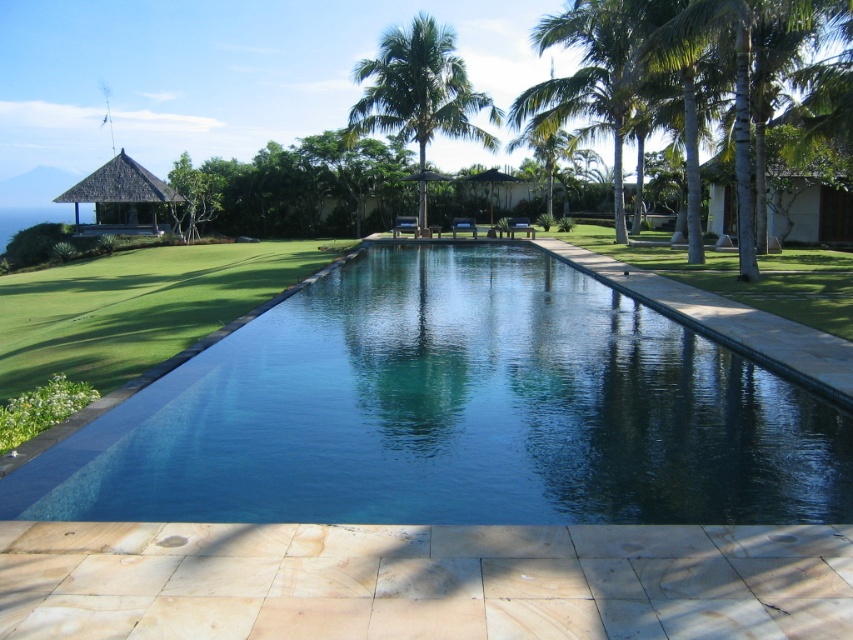
Question: Which point appears closest to the camera in this image?

Choices:
 (A) (241, 344)
 (B) (572, 77)

Answer: (A)

Question: Is green leafy palm tree at upper right below matte brown hut at center?

Choices:
 (A) no
 (B) yes

Answer: (A)

Question: Which of the following is the farthest from the observer?

Choices:
 (A) blue glassy swimming pool at center
 (B) green leafy palm tree at upper right
 (C) matte brown hut at center

Answer: (C)

Question: Based on their relative distances, which object is farther from the green leafy palm tree at upper center?

Choices:
 (A) green leafy palm tree at upper right
 (B) matte brown hut at center
 (C) thatched roof hut at upper left
 (D) white wood hut at right

Answer: (C)

Question: Is blue glassy swimming pool at center to the right of green leafy palm tree at upper center from the viewer's perspective?

Choices:
 (A) no
 (B) yes

Answer: (B)

Question: Is green leafy palm tree at upper center closer to camera compared to white wood hut at right?

Choices:
 (A) yes
 (B) no

Answer: (B)